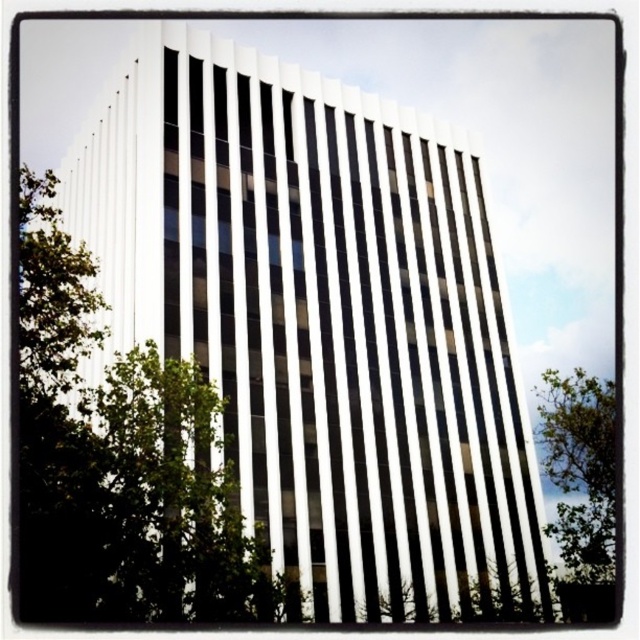
Question: Which point appears closest to the camera in this image?

Choices:
 (A) (161, 586)
 (B) (579, 525)

Answer: (A)

Question: Does green leafy tree at center have a larger size compared to green leafy tree at lower right?

Choices:
 (A) no
 (B) yes

Answer: (A)

Question: In this image, where is green leafy tree at center located relative to green leafy tree at lower right?

Choices:
 (A) right
 (B) left

Answer: (B)

Question: Among these points, which one is nearest to the camera?

Choices:
 (A) (49, 243)
 (B) (576, 560)

Answer: (A)

Question: Is green leafy tree at center below green leafy tree at lower right?

Choices:
 (A) yes
 (B) no

Answer: (B)